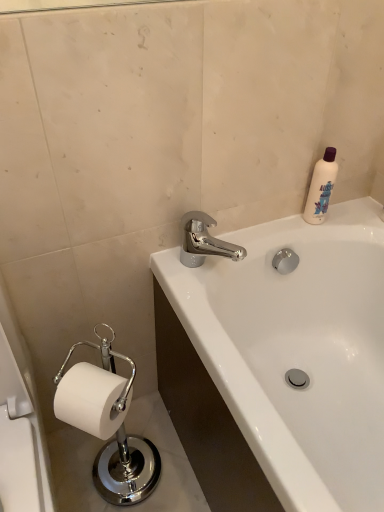
At what (x,y) coordinates should I click in order to perform the action: click on vacant space situated on the left part of chrome metallic faucet at upper center. Please return your answer as a coordinate pair (x, y). The width and height of the screenshot is (384, 512). Looking at the image, I should click on [176, 265].